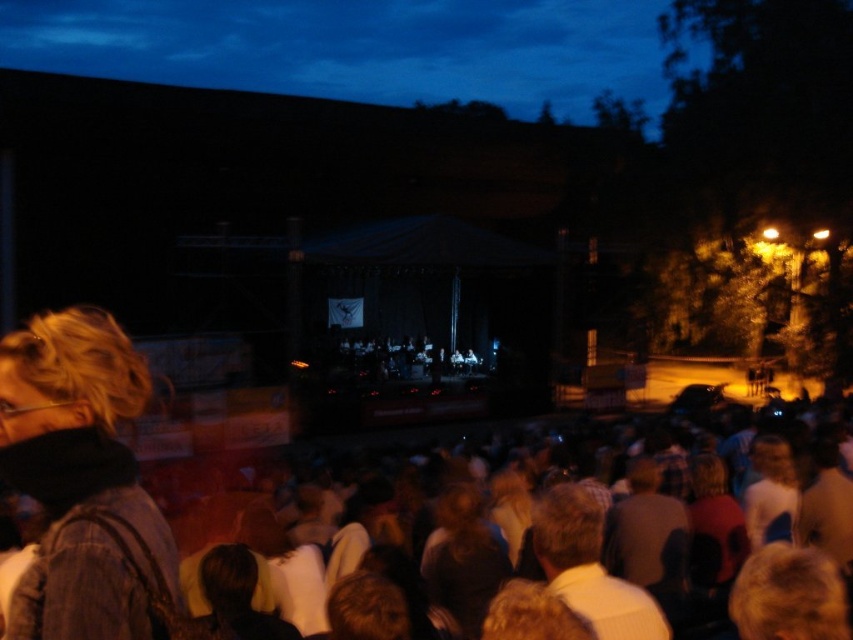
Question: Can you confirm if white cotton shirt at center is wider than light brown hair at center?

Choices:
 (A) yes
 (B) no

Answer: (B)

Question: Among these objects, which one is farthest from the camera?

Choices:
 (A) white cotton shirt at center
 (B) denim jacket at lower left

Answer: (A)

Question: In this image, where is blonde hair at lower right located relative to gray fabric shirt at center?

Choices:
 (A) right
 (B) left

Answer: (B)

Question: Which point appears farthest from the camera in this image?

Choices:
 (A) (129, 394)
 (B) (769, 531)
 (C) (767, 573)

Answer: (B)

Question: Among these points, which one is farthest from the camera?

Choices:
 (A) (634, 460)
 (B) (62, 387)
 (C) (827, 576)

Answer: (A)

Question: Is the position of denim jacket at lower left less distant than that of gray fabric shirt at center?

Choices:
 (A) yes
 (B) no

Answer: (A)